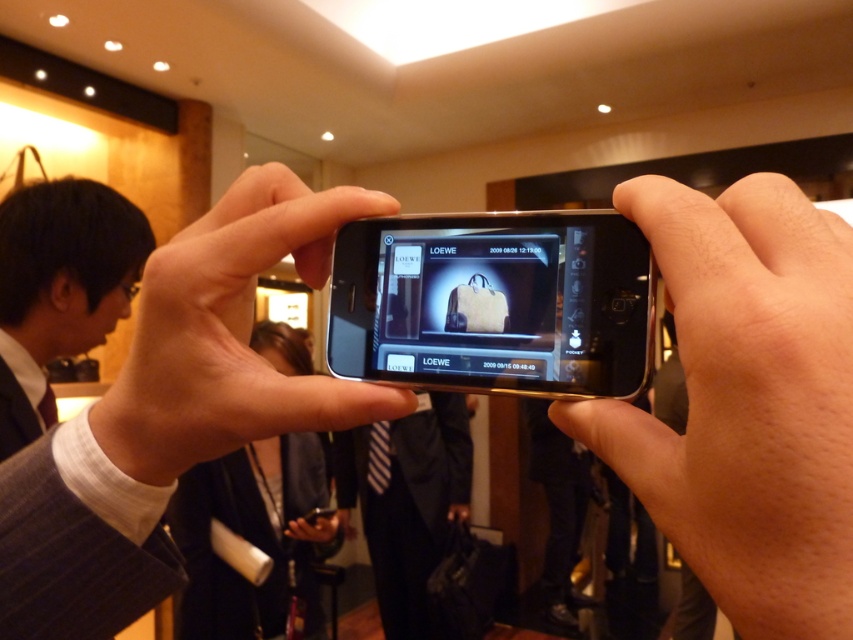
Question: Which point appears closest to the camera in this image?

Choices:
 (A) (546, 344)
 (B) (700, 317)
 (C) (392, 532)
 (D) (287, 413)

Answer: (B)

Question: Is smooth skin hand at center positioned behind satin gold phone at center?

Choices:
 (A) no
 (B) yes

Answer: (A)

Question: Is smooth skin hand at center bigger than black fabric suit at center?

Choices:
 (A) no
 (B) yes

Answer: (A)

Question: Can you confirm if smooth skin hand at center is positioned to the left of satin black smartphone at center?

Choices:
 (A) yes
 (B) no

Answer: (B)

Question: Which of these objects is positioned farthest from the satin black smartphone at center?

Choices:
 (A) black fabric suit at center
 (B) black suit at left
 (C) smooth skin hand at center

Answer: (A)

Question: Estimate the real-world distances between objects in this image. Which object is farther from the black suit at left?

Choices:
 (A) smooth skin hand at center
 (B) satin gold phone at center
 (C) black fabric suit at center

Answer: (C)